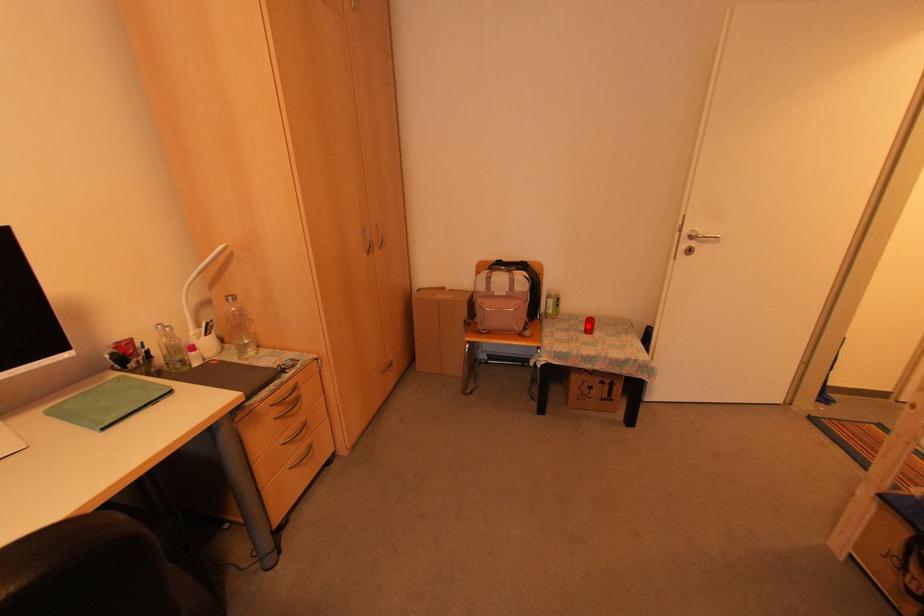
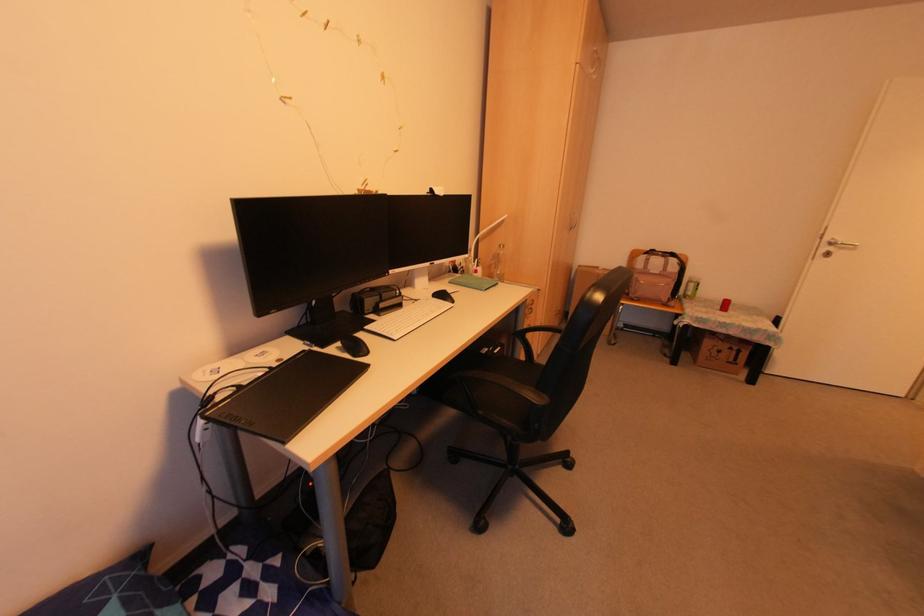
Question: I am providing you with two images of the same scene from different viewpoints. A red point is marked on the first image. At the location where the point appears in image 1, is it still visible in image 2?

Choices:
 (A) Yes
 (B) No

Answer: (A)